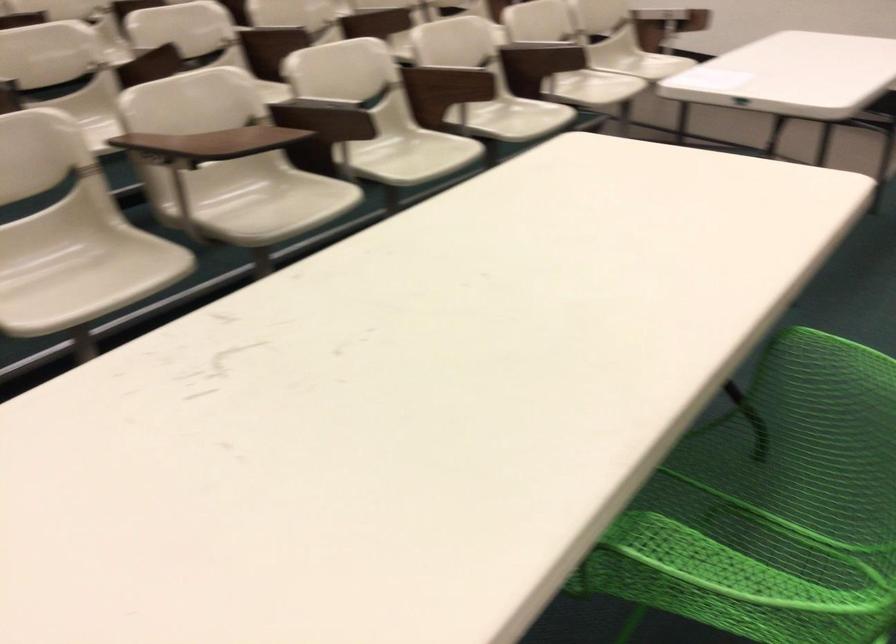
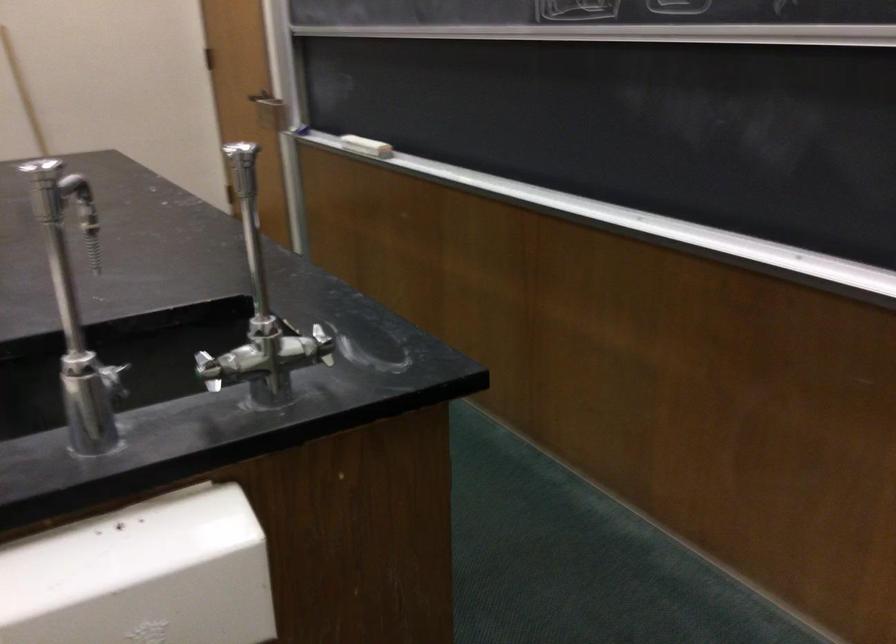
Question: How did the camera likely rotate?

Choices:
 (A) Left
 (B) Right
 (C) Up
 (D) Down

Answer: (B)